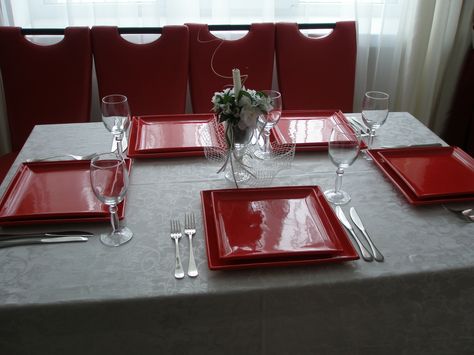
This screenshot has height=355, width=474. I want to click on place settings, so click(x=68, y=189), click(x=186, y=122), click(x=295, y=134), click(x=437, y=146), click(x=284, y=235).